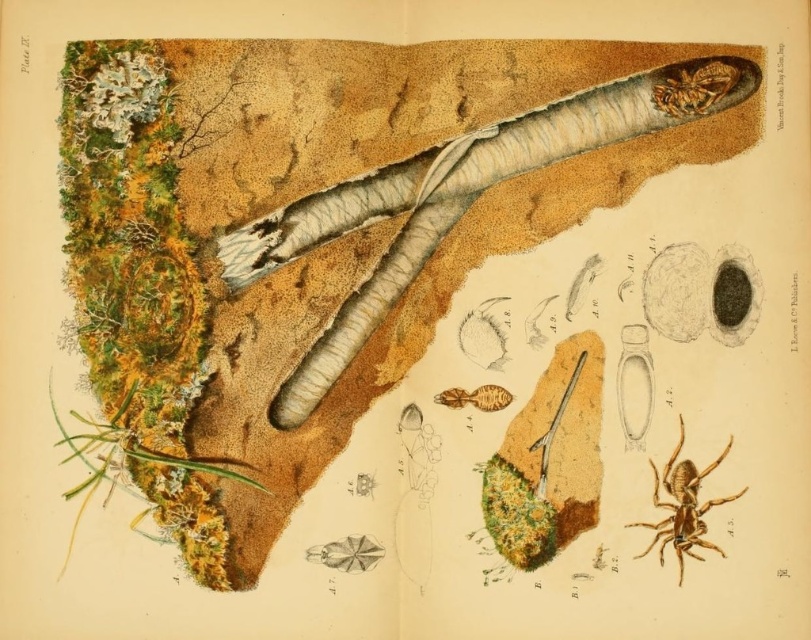
Can you confirm if white textured worm at center is thinner than brown matte spider at center?

In fact, white textured worm at center might be wider than brown matte spider at center.

Is point (726, 104) in front of point (685, 465)?

No, it is behind (685, 465).

What are the coordinates of `white textured worm at center` in the screenshot? It's located at (421, 214).

Where is `white textured worm at center`? This screenshot has width=811, height=640. white textured worm at center is located at coordinates (421, 214).

Does brown matte spider at center appear under shiny brown beetle at upper right?

Indeed, brown matte spider at center is positioned under shiny brown beetle at upper right.

Is brown matte spider at center shorter than shiny brown beetle at upper right?

In fact, brown matte spider at center may be taller than shiny brown beetle at upper right.

Where is `brown matte spider at center`? brown matte spider at center is located at coordinates (681, 506).

Is white textured worm at center taller than translucent amber insect at center?

Correct, white textured worm at center is much taller as translucent amber insect at center.

Is white textured worm at center smaller than translucent amber insect at center?

Incorrect, white textured worm at center is not smaller in size than translucent amber insect at center.

Where is `white textured worm at center`? This screenshot has height=640, width=811. white textured worm at center is located at coordinates (421, 214).